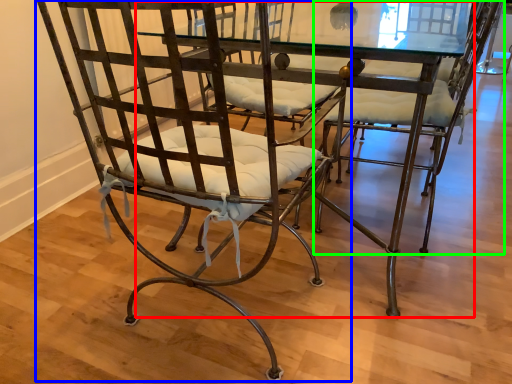
Question: Estimate the real-world distances between objects in this image. Which object is farther from round table (highlighted by a red box), chair (highlighted by a blue box) or chair (highlighted by a green box)?

Choices:
 (A) chair
 (B) chair

Answer: (B)